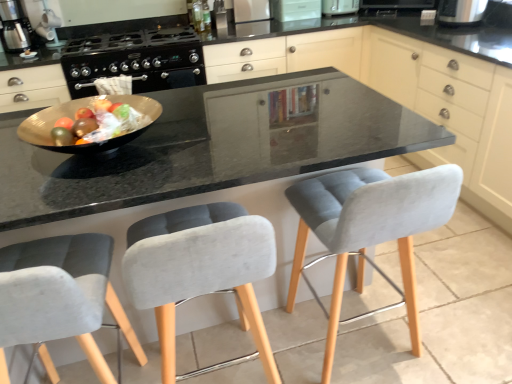
Find the location of a particular element. The height and width of the screenshot is (384, 512). free point above velvet grey chair at center, the 2th chair positioned from the right (from a real-world perspective) is located at coordinates (179, 173).